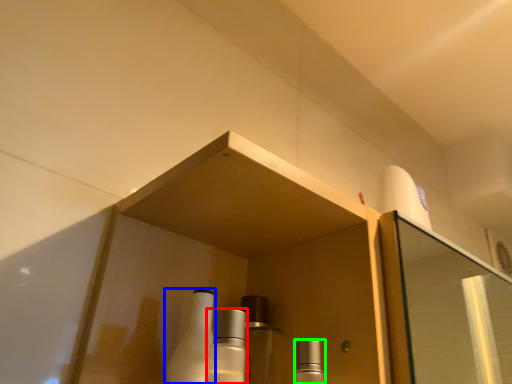
Question: Based on their relative distances, which object is farther from mouthwash (highlighted by a red box)? Choose from bottle (highlighted by a blue box) and mouthwash (highlighted by a green box).

Choices:
 (A) bottle
 (B) mouthwash

Answer: (B)